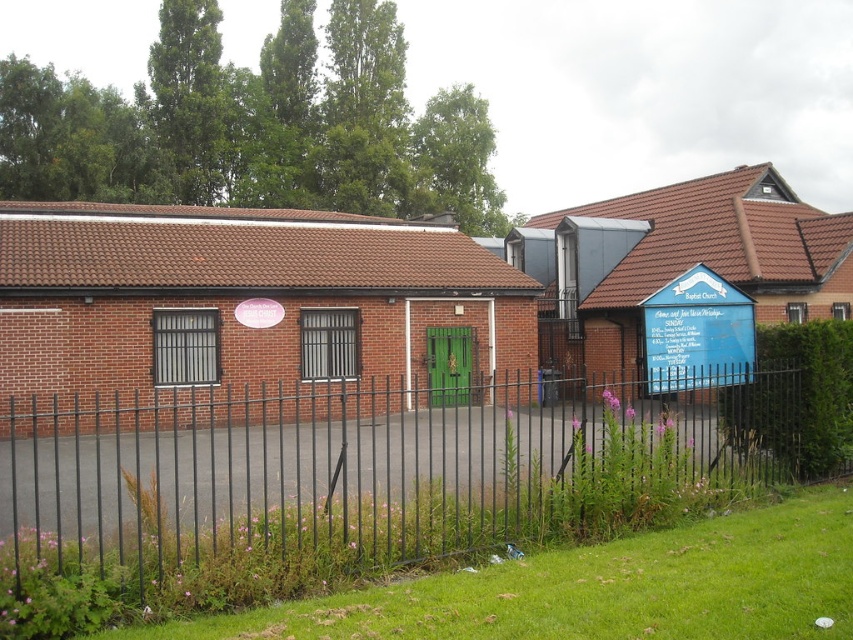
You are a delivery person trying to access the building through the gate. The black metal fence at center and the blue painted wooden sign at right are in your path. Which object should you move around first to reach the building?

You should move around the black metal fence at center first because it is in front of the blue painted wooden sign at right, meaning the fence is closer to your current position and must be navigated before reaching the sign.